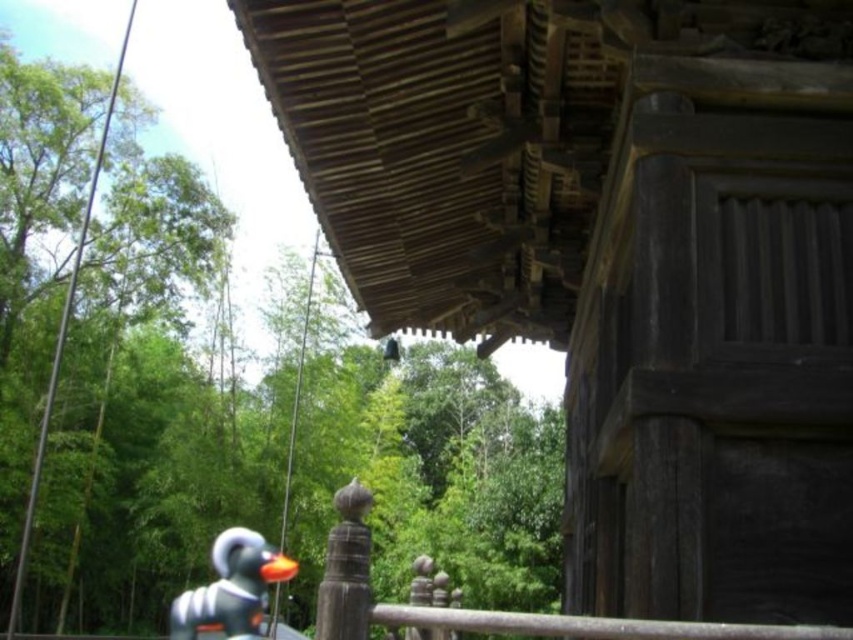
Question: Does dark brown wood at upper right appear over white matte rubber duck at lower left?

Choices:
 (A) yes
 (B) no

Answer: (A)

Question: Which point appears closest to the camera in this image?

Choices:
 (A) tap(677, 300)
 (B) tap(236, 628)

Answer: (B)

Question: Observing the image, what is the correct spatial positioning of dark brown wood at upper right in reference to white matte rubber duck at lower left?

Choices:
 (A) above
 (B) below

Answer: (A)

Question: Does dark brown wood at upper right have a lesser width compared to white matte rubber duck at lower left?

Choices:
 (A) yes
 (B) no

Answer: (A)